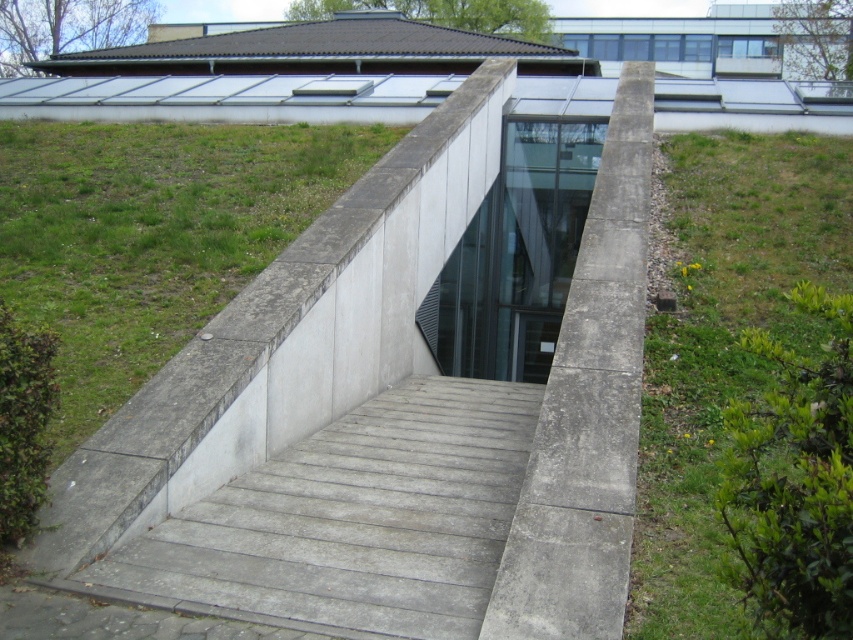
Who is more forward, (279, 604) or (646, 364)?

Positioned in front is point (279, 604).

Image resolution: width=853 pixels, height=640 pixels. What do you see at coordinates (351, 520) in the screenshot?
I see `concrete stairs at center` at bounding box center [351, 520].

Between point (323, 508) and point (698, 547), which one is positioned in front?

Positioned in front is point (698, 547).

Identify the location of concrete stairs at center. The height and width of the screenshot is (640, 853). (351, 520).